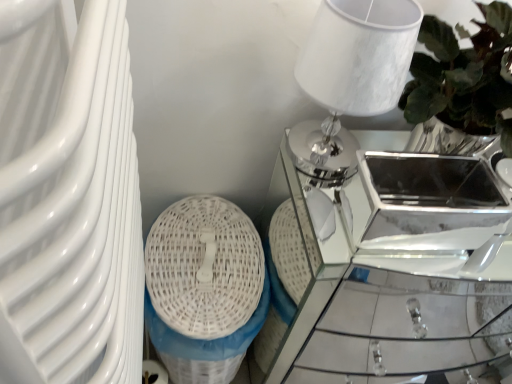
The image size is (512, 384). What do you see at coordinates (395, 266) in the screenshot?
I see `mirror glass table at center` at bounding box center [395, 266].

Locate an element on the screen. white wicker basket at lower left is located at coordinates (204, 267).

The image size is (512, 384). Find the location of `white marble table lamp at upper right`. white marble table lamp at upper right is located at coordinates (351, 76).

Does white wicker basket at lower left turn towards mirror glass table at center?

No, white wicker basket at lower left is not facing towards mirror glass table at center.

From a real-world perspective, which object rests below the other?

Result: white wicker basket at lower left is physically lower.

Can we say white wicker basket at lower left lies outside mirror glass table at center?

Yes.

Considering the positions of point (217, 275) and point (367, 286), is point (217, 275) closer or farther from the camera than point (367, 286)?

Clearly, point (217, 275) is closer to the camera than point (367, 286).

Could you tell me if mirror glass table at center is turned towards white wicker basket at lower left?

No, mirror glass table at center is not oriented towards white wicker basket at lower left.

Is mirror glass table at center to the left or to the right of white wicker basket at lower left in the image?

mirror glass table at center is positioned on white wicker basket at lower left's right side.

Is mirror glass table at center next to white wicker basket at lower left and touching it?

mirror glass table at center and white wicker basket at lower left are clearly separated.

Considering the positions of objects mirror glass table at center and white wicker basket at lower left in the image provided, who is behind, mirror glass table at center or white wicker basket at lower left?

Positioned behind is white wicker basket at lower left.

Looking at this image, from a real-world perspective, relative to white marble table lamp at upper right, is mirror glass table at center vertically above or below?

In terms of real-world spatial position, mirror glass table at center is below white marble table lamp at upper right.

Based on the photo, is mirror glass table at center looking in the opposite direction of white marble table lamp at upper right?

No.

Which is closer, (466, 237) or (322, 56)?

The point (322, 56) is in front.

Can you confirm if mirror glass table at center is taller than white marble table lamp at upper right?

Yes, mirror glass table at center is taller than white marble table lamp at upper right.

Between point (160, 243) and point (336, 3), which one is positioned behind?

The point (160, 243) is farther.

Does white wicker basket at lower left come in front of white marble table lamp at upper right?

No, it is not.

Does white wicker basket at lower left turn towards white marble table lamp at upper right?

No, white wicker basket at lower left is not oriented towards white marble table lamp at upper right.

From a real-world perspective, is white wicker basket at lower left on top of white marble table lamp at upper right?

No.

Is white marble table lamp at upper right completely or partially outside of mirror glass table at center?

Yes, white marble table lamp at upper right is outside of mirror glass table at center.

Does white marble table lamp at upper right have a lesser width compared to mirror glass table at center?

Indeed, white marble table lamp at upper right has a lesser width compared to mirror glass table at center.

Is white marble table lamp at upper right looking in the opposite direction of mirror glass table at center?

No, white marble table lamp at upper right's orientation is not away from mirror glass table at center.

From a real-world perspective, is white marble table lamp at upper right located beneath white wicker basket at lower left?

No.

Can you confirm if white marble table lamp at upper right is positioned to the left of white wicker basket at lower left?

In fact, white marble table lamp at upper right is to the right of white wicker basket at lower left.

Is white marble table lamp at upper right taller or shorter than white wicker basket at lower left?

In the image, white marble table lamp at upper right appears to be shorter than white wicker basket at lower left.

What's the angular difference between white marble table lamp at upper right and white wicker basket at lower left's facing directions?

white marble table lamp at upper right and white wicker basket at lower left are facing 0.956 degrees away from each other.

This screenshot has width=512, height=384. Find the location of `table located above the white wicker basket at lower left (from a real-world perspective)`. table located above the white wicker basket at lower left (from a real-world perspective) is located at coordinates (395, 266).

Identify the location of basket that is behind the mirror glass table at center. Image resolution: width=512 pixels, height=384 pixels. (204, 267).

Which object lies nearer to the anchor point white wicker basket at lower left, mirror glass table at center or white marble table lamp at upper right?

white marble table lamp at upper right.

When comparing their distances from white marble table lamp at upper right, does mirror glass table at center or white wicker basket at lower left seem closer?

white wicker basket at lower left.

Estimate the real-world distances between objects in this image. Which object is closer to white marble table lamp at upper right, white wicker basket at lower left or mirror glass table at center?

white wicker basket at lower left is closer to white marble table lamp at upper right.

When comparing their distances from white wicker basket at lower left, does white marble table lamp at upper right or mirror glass table at center seem closer?

Based on the image, white marble table lamp at upper right appears to be nearer to white wicker basket at lower left.

Looking at the image, which one is located closer to mirror glass table at center, white marble table lamp at upper right or white wicker basket at lower left?

white wicker basket at lower left lies closer to mirror glass table at center than the other object.

Looking at the image, which one is located closer to mirror glass table at center, white wicker basket at lower left or white marble table lamp at upper right?

Based on the image, white wicker basket at lower left appears to be nearer to mirror glass table at center.

Where is `table lamp situated between white wicker basket at lower left and mirror glass table at center from left to right`? This screenshot has width=512, height=384. table lamp situated between white wicker basket at lower left and mirror glass table at center from left to right is located at coordinates click(351, 76).